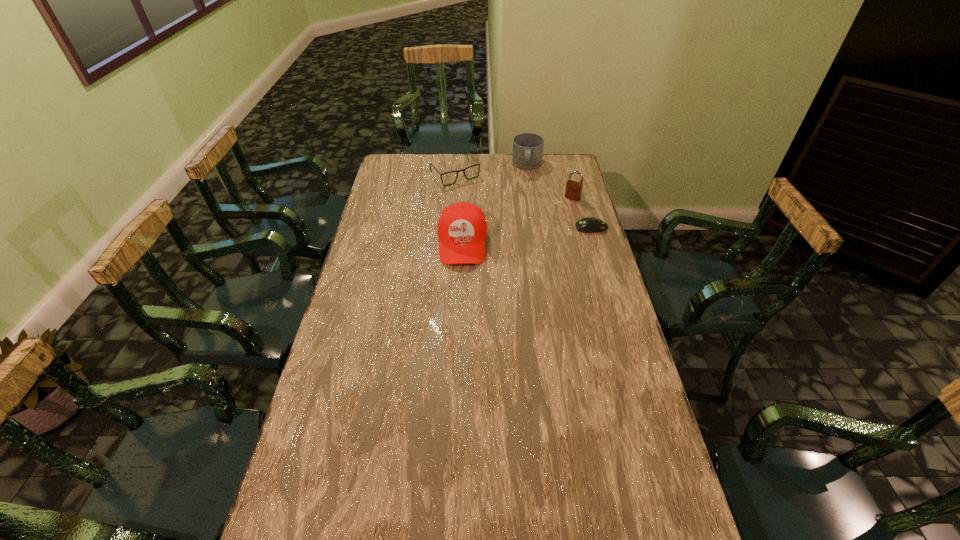
Locate an element on the screen. vacant point located between the spectacles and the third object from right to left is located at coordinates (492, 170).

At what (x,y) coordinates should I click in order to perform the action: click on free space between the shortest object and the spectacles. Please return your answer as a coordinate pair (x, y). Looking at the image, I should click on (523, 201).

The height and width of the screenshot is (540, 960). In order to click on vacant space that is in between the baseball cap and the third farthest object in this screenshot , I will do `click(517, 220)`.

The width and height of the screenshot is (960, 540). I want to click on vacant point located between the computer mouse and the baseball cap, so click(527, 235).

Image resolution: width=960 pixels, height=540 pixels. What are the coordinates of `empty space that is in between the mug and the second shortest object` in the screenshot? It's located at (492, 170).

Where is `vacant area that lies between the computer mouse and the padlock`? The width and height of the screenshot is (960, 540). vacant area that lies between the computer mouse and the padlock is located at coordinates (582, 213).

Select which object appears as the third closest to the shortest object. Please provide its 2D coordinates. Your answer should be formatted as a tuple, i.e. [(x, y)], where the tuple contains the x and y coordinates of a point satisfying the conditions above.

[(527, 153)]

Identify which object is the fourth closest to the baseball cap. Please provide its 2D coordinates. Your answer should be formatted as a tuple, i.e. [(x, y)], where the tuple contains the x and y coordinates of a point satisfying the conditions above.

[(527, 153)]